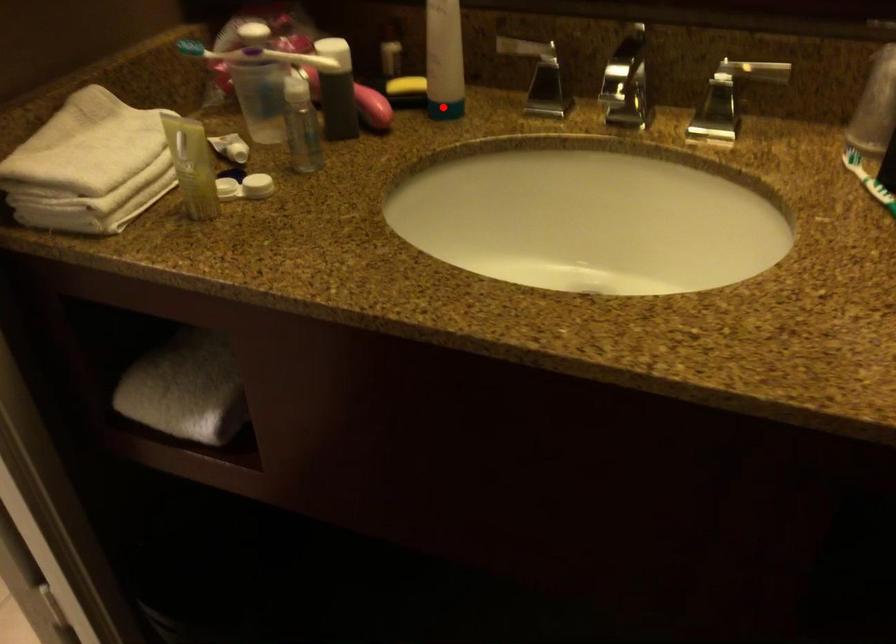
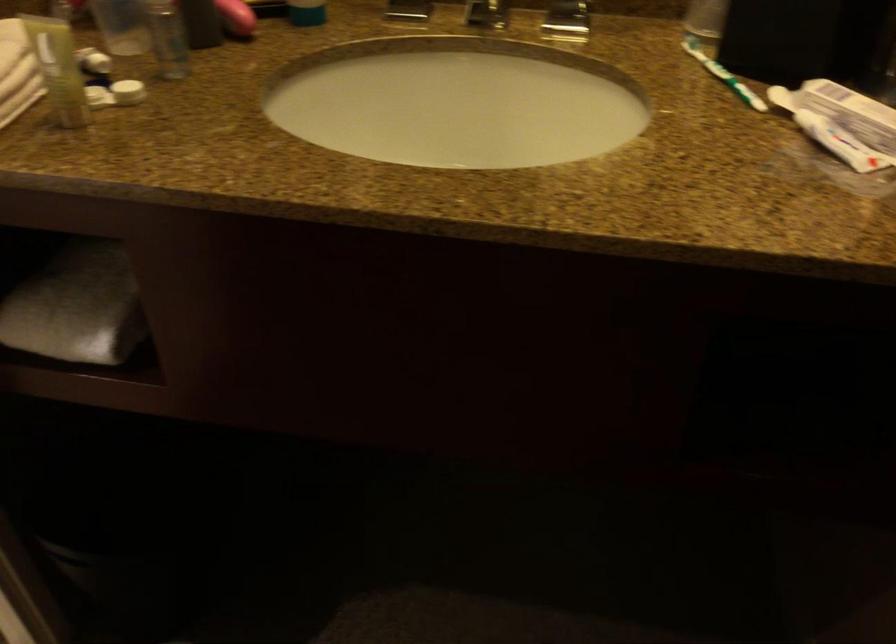
Locate, in the second image, the point that corresponds to the highlighted location in the first image.

(306, 13)